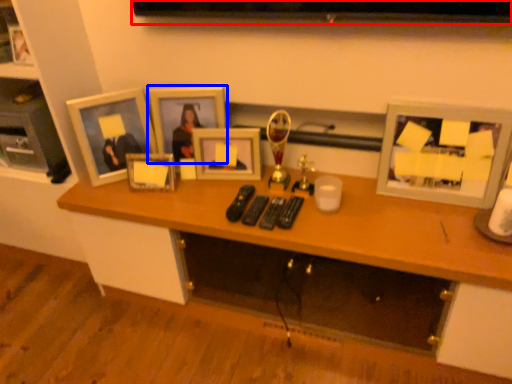
Question: Which object appears farthest to the camera in this image, television (highlighted by a red box) or picture frame (highlighted by a blue box)?

Choices:
 (A) television
 (B) picture frame

Answer: (B)